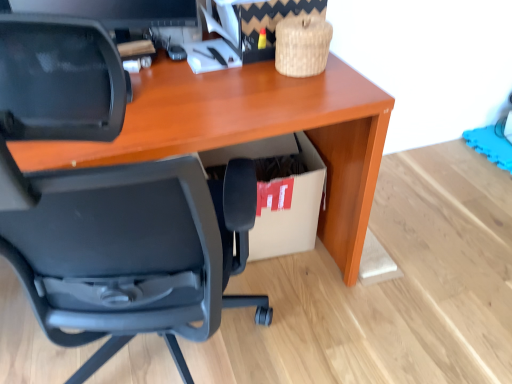
Image resolution: width=512 pixels, height=384 pixels. Find the location of `vacant area that is situated to the right of black plastic chair at lower left`. vacant area that is situated to the right of black plastic chair at lower left is located at coordinates (376, 322).